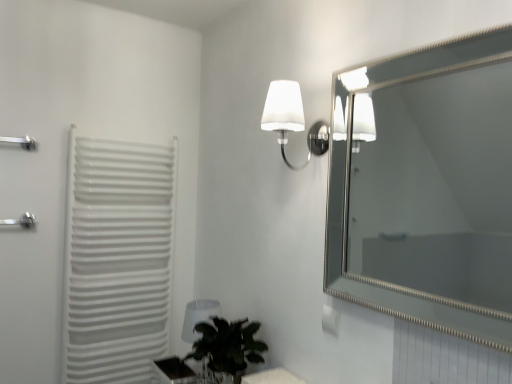
Question: From the image's perspective, is transparent plastic table lamp at lower center on top of white plastic radiator at left?

Choices:
 (A) no
 (B) yes

Answer: (A)

Question: Is transparent plastic table lamp at lower center at the right side of white plastic radiator at left?

Choices:
 (A) no
 (B) yes

Answer: (B)

Question: Is transparent plastic table lamp at lower center taller than white plastic radiator at left?

Choices:
 (A) yes
 (B) no

Answer: (B)

Question: Does transparent plastic table lamp at lower center have a lesser height compared to white plastic radiator at left?

Choices:
 (A) no
 (B) yes

Answer: (B)

Question: Is white plastic radiator at left at the back of transparent plastic table lamp at lower center?

Choices:
 (A) yes
 (B) no

Answer: (B)

Question: Considering the positions of translucent glass table at lower center and silver/metallic mirror at upper right in the image, is translucent glass table at lower center wider or thinner than silver/metallic mirror at upper right?

Choices:
 (A) thin
 (B) wide

Answer: (B)

Question: Is translucent glass table at lower center taller or shorter than silver/metallic mirror at upper right?

Choices:
 (A) short
 (B) tall

Answer: (A)

Question: From the image's perspective, relative to silver/metallic mirror at upper right, is translucent glass table at lower center above or below?

Choices:
 (A) above
 (B) below

Answer: (B)

Question: Considering the positions of point (267, 370) and point (502, 82), is point (267, 370) closer or farther from the camera than point (502, 82)?

Choices:
 (A) closer
 (B) farther

Answer: (A)

Question: Would you say transparent plastic table lamp at lower center is to the left or to the right of green leafy plant at lower center in the picture?

Choices:
 (A) right
 (B) left

Answer: (B)

Question: From the image's perspective, relative to green leafy plant at lower center, is transparent plastic table lamp at lower center above or below?

Choices:
 (A) below
 (B) above

Answer: (A)

Question: Is transparent plastic table lamp at lower center spatially inside green leafy plant at lower center, or outside of it?

Choices:
 (A) inside
 (B) outside

Answer: (B)

Question: Based on their sizes in the image, would you say transparent plastic table lamp at lower center is bigger or smaller than green leafy plant at lower center?

Choices:
 (A) small
 (B) big

Answer: (A)

Question: Is translucent glass table at lower center in front of or behind silver metallic towel bar at left in the image?

Choices:
 (A) behind
 (B) front

Answer: (B)

Question: From a real-world perspective, is translucent glass table at lower center physically located above or below silver metallic towel bar at left?

Choices:
 (A) above
 (B) below

Answer: (B)